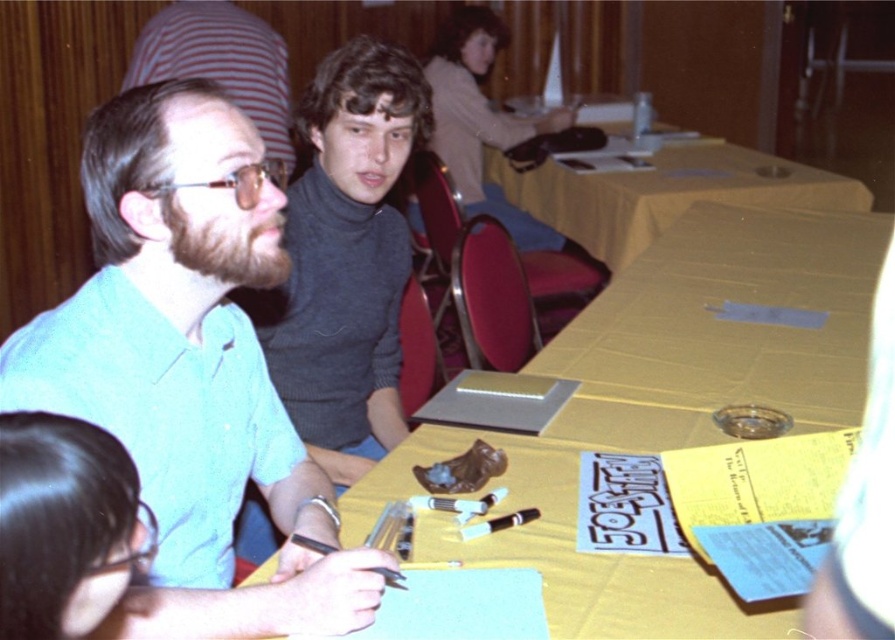
Can you confirm if yellow fabric table at center is wider than light beige sweater at upper center?

Indeed, yellow fabric table at center has a greater width compared to light beige sweater at upper center.

The width and height of the screenshot is (895, 640). Find the location of `yellow fabric table at center`. yellow fabric table at center is located at coordinates pos(665,193).

This screenshot has width=895, height=640. What are the coordinates of `yellow fabric table at center` in the screenshot? It's located at (665, 193).

Locate an element on the screen. Image resolution: width=895 pixels, height=640 pixels. teal shirt at center is located at coordinates (190, 369).

Does teal shirt at center appear under yellow fabric table at center?

Yes, teal shirt at center is below yellow fabric table at center.

Describe the element at coordinates (190, 369) in the screenshot. I see `teal shirt at center` at that location.

In order to click on teal shirt at center in this screenshot , I will do `click(190, 369)`.

Is point (692, 438) positioned behind point (558, 212)?

No, (692, 438) is in front of (558, 212).

Is yellow paper at center below yellow fabric table at center?

Yes, yellow paper at center is below yellow fabric table at center.

Is point (774, 330) closer to viewer compared to point (846, 193)?

Yes.

You are a GUI agent. You are given a task and a screenshot of the screen. Output one action in this format:
    pyautogui.click(x=<x>, y=<y>)
    Task: Click on the yellow paper at center
    Image resolution: width=895 pixels, height=640 pixels.
    Given the screenshot: What is the action you would take?
    pyautogui.click(x=669, y=404)